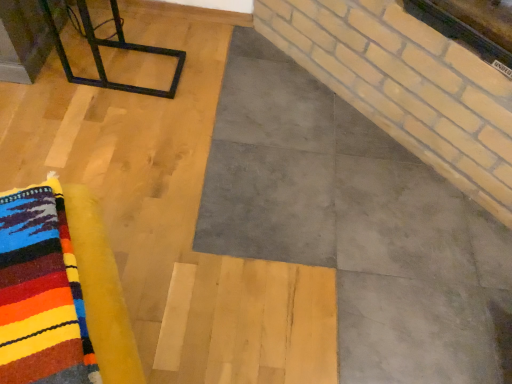
What do you see at coordinates (111, 47) in the screenshot? Image resolution: width=512 pixels, height=384 pixels. I see `black metal frame at upper left` at bounding box center [111, 47].

The image size is (512, 384). What are the coordinates of `black metal frame at upper left` in the screenshot? It's located at (111, 47).

In order to face black metal frame at upper left, should I rotate leftwards or rightwards?

You should look left and rotate roughly 17.537 degrees.

Measure the distance between point (47, 16) and camera.

Point (47, 16) is 1.67 meters from camera.

Measure the distance between point (61, 280) and camera.

They are 28.11 inches apart.

The height and width of the screenshot is (384, 512). Describe the element at coordinates (41, 292) in the screenshot. I see `multicolored wool rug at lower left` at that location.

Where is `multicolored wool rug at lower left`? The height and width of the screenshot is (384, 512). multicolored wool rug at lower left is located at coordinates (41, 292).

Locate an element on the screen. The image size is (512, 384). black metal frame at upper left is located at coordinates (111, 47).

Which is more to the right, multicolored wool rug at lower left or black metal frame at upper left?

From the viewer's perspective, multicolored wool rug at lower left appears more on the right side.

Between multicolored wool rug at lower left and black metal frame at upper left, which one is positioned in front?

multicolored wool rug at lower left is in front.

Is point (21, 262) positioned after point (179, 55)?

That is False.

From the image's perspective, is multicolored wool rug at lower left on black metal frame at upper left?

No.

From a real-world perspective, which is physically above, multicolored wool rug at lower left or black metal frame at upper left?

multicolored wool rug at lower left is physically above.

Which object is thinner, multicolored wool rug at lower left or black metal frame at upper left?

With smaller width is multicolored wool rug at lower left.

Looking at this image, between multicolored wool rug at lower left and black metal frame at upper left, which one has less height?

black metal frame at upper left is shorter.

Is multicolored wool rug at lower left smaller than black metal frame at upper left?

Yes, multicolored wool rug at lower left is smaller than black metal frame at upper left.

Consider the image. Is black metal frame at upper left inside multicolored wool rug at lower left?

Definitely not — black metal frame at upper left is not inside multicolored wool rug at lower left.

Consider the image. Is there a large distance between multicolored wool rug at lower left and black metal frame at upper left?

Yes, multicolored wool rug at lower left and black metal frame at upper left are located far from each other.

Is multicolored wool rug at lower left facing away from black metal frame at upper left?

No, black metal frame at upper left is not at the back of multicolored wool rug at lower left.

From the picture: How different are the orientations of multicolored wool rug at lower left and black metal frame at upper left in degrees?

There is a 61.6-degree angle between the facing directions of multicolored wool rug at lower left and black metal frame at upper left.

You are a GUI agent. You are given a task and a screenshot of the screen. Output one action in this format:
    pyautogui.click(x=<x>, y=<y>)
    Task: Click on the cloth below the black metal frame at upper left (from the image's perspective)
    Image resolution: width=512 pixels, height=384 pixels.
    Given the screenshot: What is the action you would take?
    coord(41,292)

In the scene shown: Can you confirm if black metal frame at upper left is positioned to the left of multicolored wool rug at lower left?

Indeed, black metal frame at upper left is positioned on the left side of multicolored wool rug at lower left.

Considering the relative positions of black metal frame at upper left and multicolored wool rug at lower left in the image provided, is black metal frame at upper left in front of multicolored wool rug at lower left?

No.

Between point (55, 30) and point (45, 356), which one is positioned in front?

The point (45, 356) is more forward.

From the image's perspective, is black metal frame at upper left above multicolored wool rug at lower left?

Indeed, from the image's perspective, black metal frame at upper left is shown above multicolored wool rug at lower left.

From a real-world perspective, is black metal frame at upper left positioned under multicolored wool rug at lower left based on gravity?

Yes, from a real-world perspective, black metal frame at upper left is under multicolored wool rug at lower left.

Looking at this image, does black metal frame at upper left have a lesser width compared to multicolored wool rug at lower left?

No.

Which of these two, black metal frame at upper left or multicolored wool rug at lower left, stands shorter?

black metal frame at upper left.

Considering the relative sizes of black metal frame at upper left and multicolored wool rug at lower left in the image provided, is black metal frame at upper left smaller than multicolored wool rug at lower left?

No, black metal frame at upper left is not smaller than multicolored wool rug at lower left.

Based on the photo, is black metal frame at upper left inside or outside of multicolored wool rug at lower left?

black metal frame at upper left is not enclosed by multicolored wool rug at lower left.

Is black metal frame at upper left not close to multicolored wool rug at lower left?

Absolutely, black metal frame at upper left is distant from multicolored wool rug at lower left.

In the scene shown: Is black metal frame at upper left facing away from multicolored wool rug at lower left?

black metal frame at upper left is not turned away from multicolored wool rug at lower left.

Can you tell me how much black metal frame at upper left and multicolored wool rug at lower left differ in facing direction?

The angle between the facing direction of black metal frame at upper left and the facing direction of multicolored wool rug at lower left is 61.6 degrees.

At what (x,y) coordinates should I click in order to perform the action: click on cloth below the black metal frame at upper left (from the image's perspective). Please return your answer as a coordinate pair (x, y). The height and width of the screenshot is (384, 512). Looking at the image, I should click on (41, 292).

This screenshot has width=512, height=384. In order to click on furniture lying above the multicolored wool rug at lower left (from the image's perspective) in this screenshot , I will do `click(111, 47)`.

Image resolution: width=512 pixels, height=384 pixels. In order to click on cloth below the black metal frame at upper left (from the image's perspective) in this screenshot , I will do `click(41, 292)`.